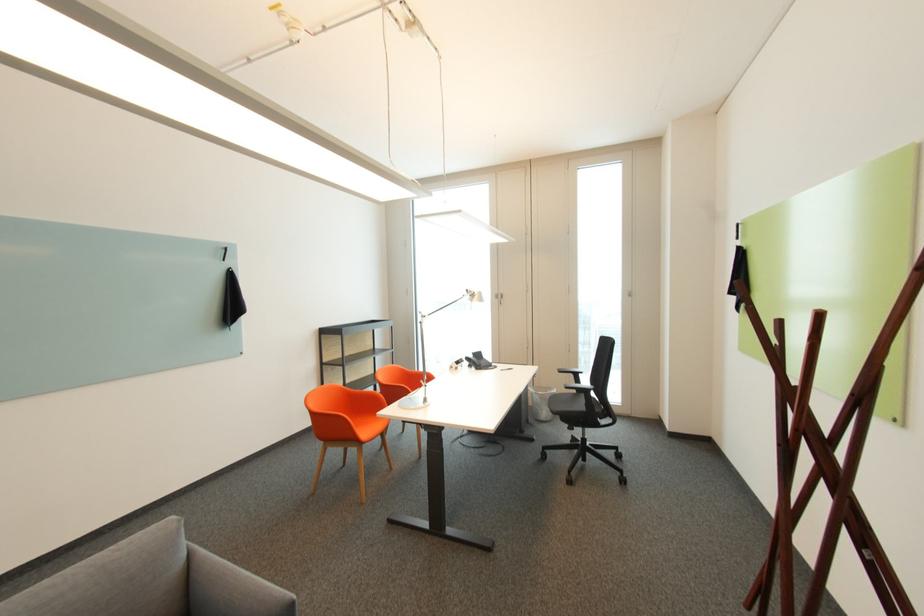
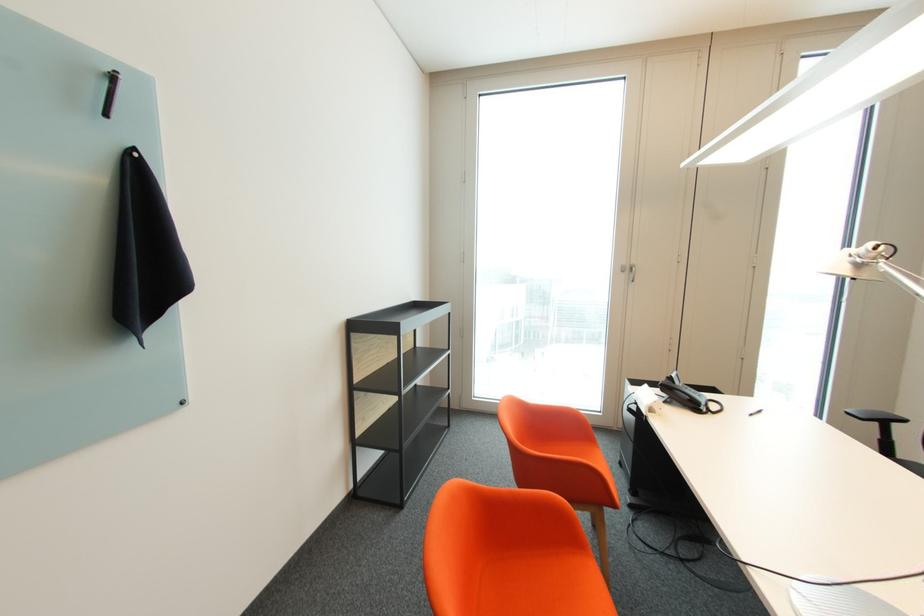
In a continuous first-person perspective shot, in which direction is the camera moving?

The movement direction of the cameraman is left, forward.